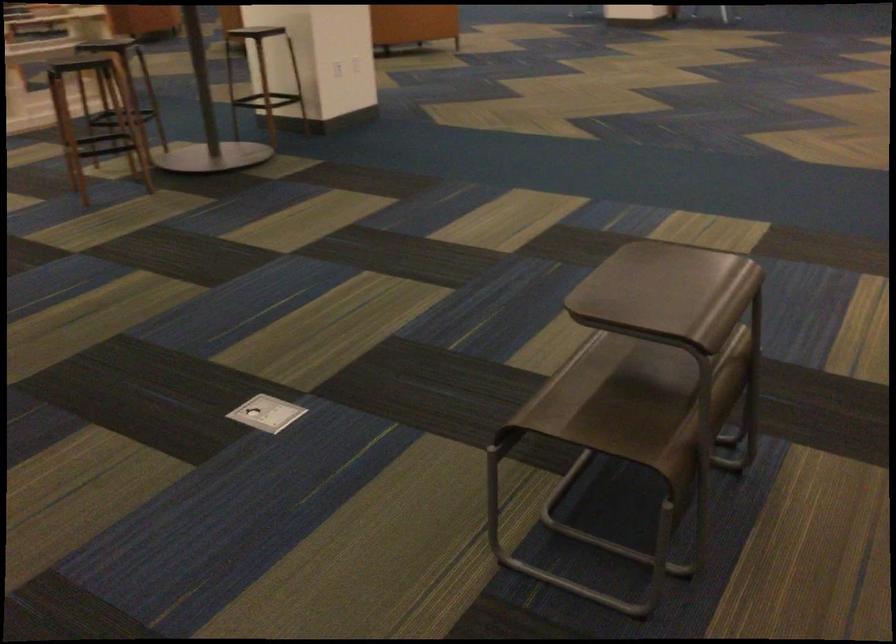
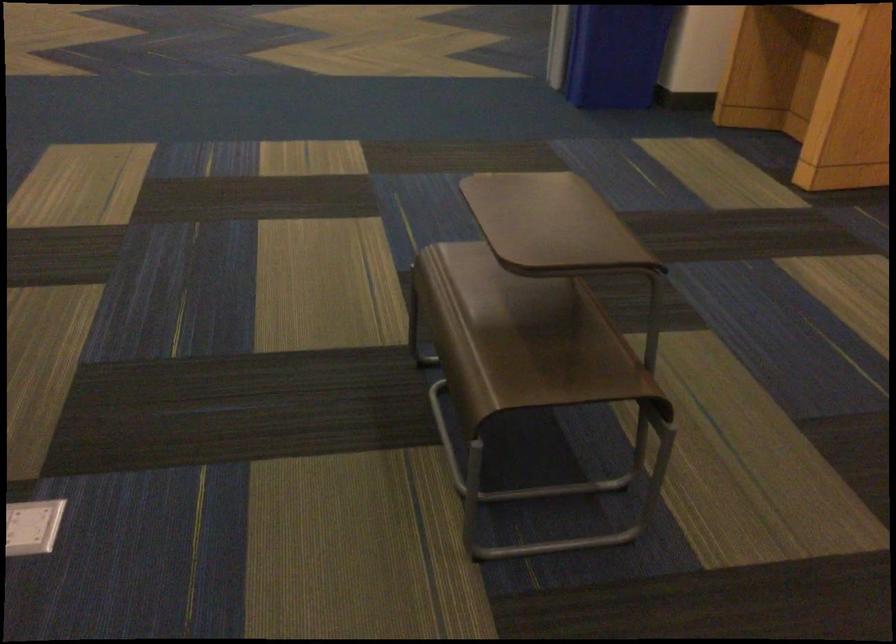
Locate, in the second image, the point that corresponds to (x=606, y=399) in the first image.

(531, 346)